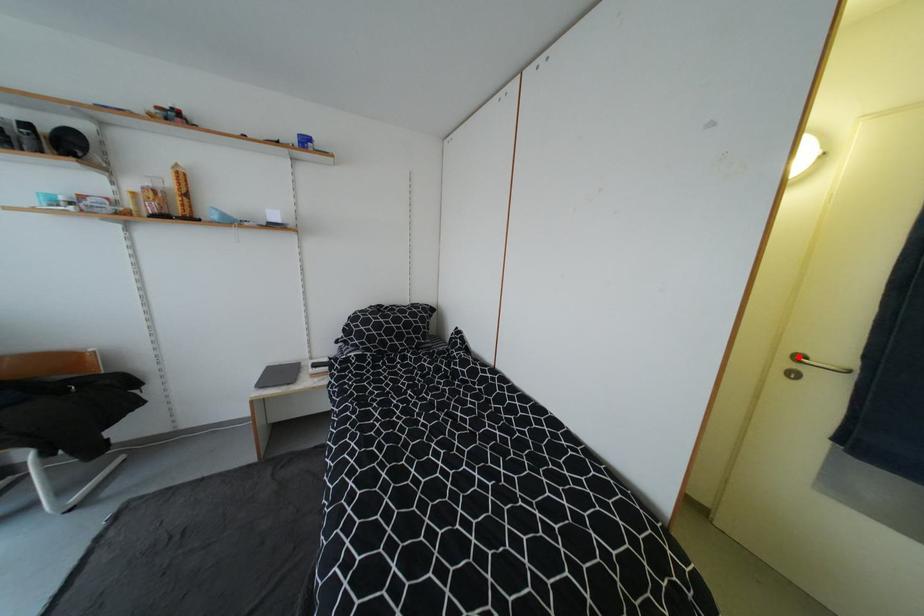
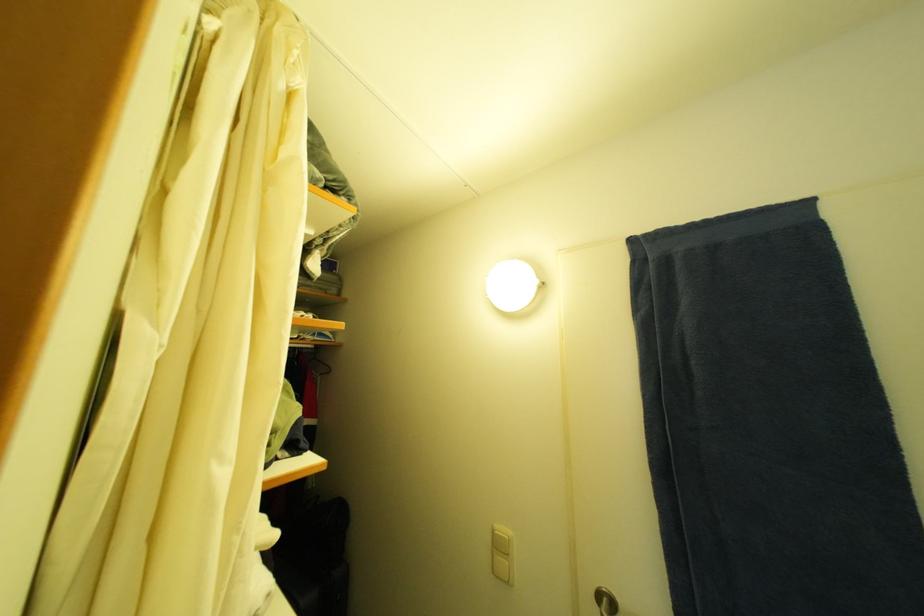
Find the pixel in the second image that matches the highlighted location in the first image.

(603, 596)